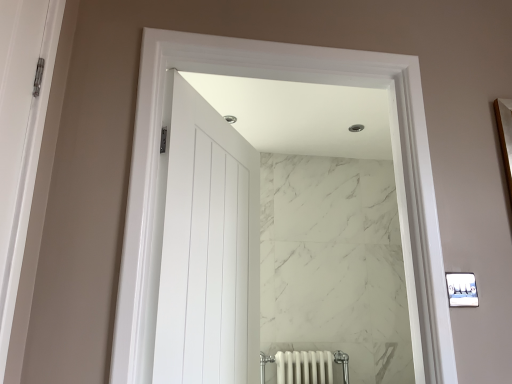
Question: Should I look upward or downward to see white glossy door at center?

Choices:
 (A) up
 (B) down

Answer: (B)

Question: Is white marble wall at center next to white glossy door at center and touching it?

Choices:
 (A) yes
 (B) no

Answer: (B)

Question: Can white glossy door at center be found inside white marble wall at center?

Choices:
 (A) no
 (B) yes

Answer: (A)

Question: Can you confirm if white marble wall at center is positioned to the right of white glossy door at center?

Choices:
 (A) no
 (B) yes

Answer: (B)

Question: Does white marble wall at center have a lesser width compared to white glossy door at center?

Choices:
 (A) no
 (B) yes

Answer: (B)

Question: From a real-world perspective, does white marble wall at center sit lower than white glossy door at center?

Choices:
 (A) yes
 (B) no

Answer: (B)

Question: Considering the relative sizes of white marble wall at center and white glossy door at center in the image provided, is white marble wall at center bigger than white glossy door at center?

Choices:
 (A) no
 (B) yes

Answer: (A)

Question: Is white glossy door at center oriented away from white marble wall at center?

Choices:
 (A) yes
 (B) no

Answer: (A)

Question: Would you say white glossy door at center is outside white marble wall at center?

Choices:
 (A) yes
 (B) no

Answer: (A)

Question: Could you tell me if white glossy door at center is turned towards white marble wall at center?

Choices:
 (A) no
 (B) yes

Answer: (B)

Question: Does white glossy door at center have a greater width compared to white marble wall at center?

Choices:
 (A) yes
 (B) no

Answer: (A)

Question: From a real-world perspective, is white glossy door at center positioned over white marble wall at center based on gravity?

Choices:
 (A) yes
 (B) no

Answer: (B)

Question: Can you confirm if white glossy door at center is bigger than white marble wall at center?

Choices:
 (A) yes
 (B) no

Answer: (A)

Question: From the image's perspective, is white glossy door at center above or below white marble wall at center?

Choices:
 (A) below
 (B) above

Answer: (A)